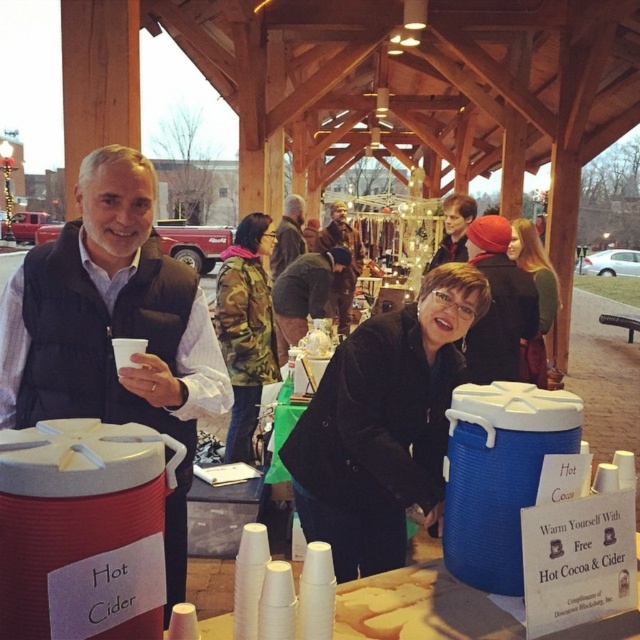
Question: Which object is farther from the camera taking this photo?

Choices:
 (A) brown leather jacket at center
 (B) matte black jacket at center
 (C) black velvet coat at center
 (D) brown fuzzy coat at center

Answer: (A)

Question: Does camouflage jacket at center have a greater width compared to matte black jacket at center?

Choices:
 (A) no
 (B) yes

Answer: (A)

Question: Is camouflage jacket at center bigger than brown leather jacket at center?

Choices:
 (A) yes
 (B) no

Answer: (B)

Question: Can you confirm if matte black jacket at center is positioned above brown fuzzy coat at center?

Choices:
 (A) no
 (B) yes

Answer: (A)

Question: Estimate the real-world distances between objects in this image. Which object is closer to the matte black jacket at center?

Choices:
 (A) black velvet coat at center
 (B) black matte jacket at center
 (C) brown leather jacket at center
 (D) brown fuzzy coat at center

Answer: (B)

Question: Which is farther from the black velvet coat at center?

Choices:
 (A) brown leather jacket at center
 (B) matte black vest at left
 (C) brown fuzzy coat at center
 (D) camouflage jacket at center

Answer: (A)